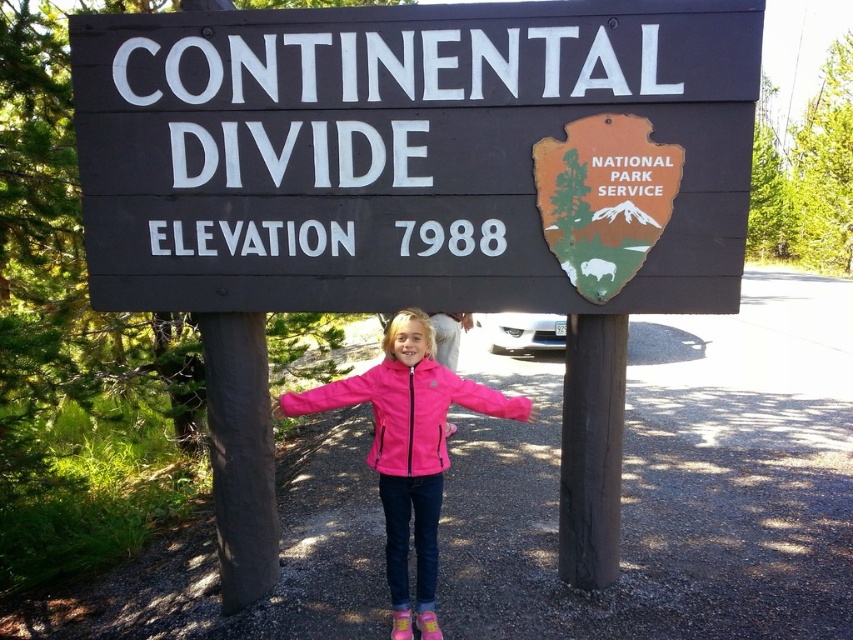
Question: Which of the following is the closest to the observer?

Choices:
 (A) black wood pole at center
 (B) pink fleece jacket at center

Answer: (B)

Question: Which object appears farthest from the camera in this image?

Choices:
 (A) dark wood sign at center
 (B) pink softshell jacket at center
 (C) black wood pole at center

Answer: (C)

Question: Which is nearer to the pink fleece jacket at center?

Choices:
 (A) black wood pole at center
 (B) brown wood pole at left
 (C) pink softshell jacket at center
 (D) dark wood sign at center

Answer: (C)

Question: In this image, where is dark wood sign at center located relative to pink softshell jacket at center?

Choices:
 (A) below
 (B) above

Answer: (B)

Question: Observing the image, what is the correct spatial positioning of dark wood sign at center in reference to brown wood pole at left?

Choices:
 (A) right
 (B) left

Answer: (A)

Question: Does brown wood pole at left appear over pink fleece jacket at center?

Choices:
 (A) yes
 (B) no

Answer: (B)